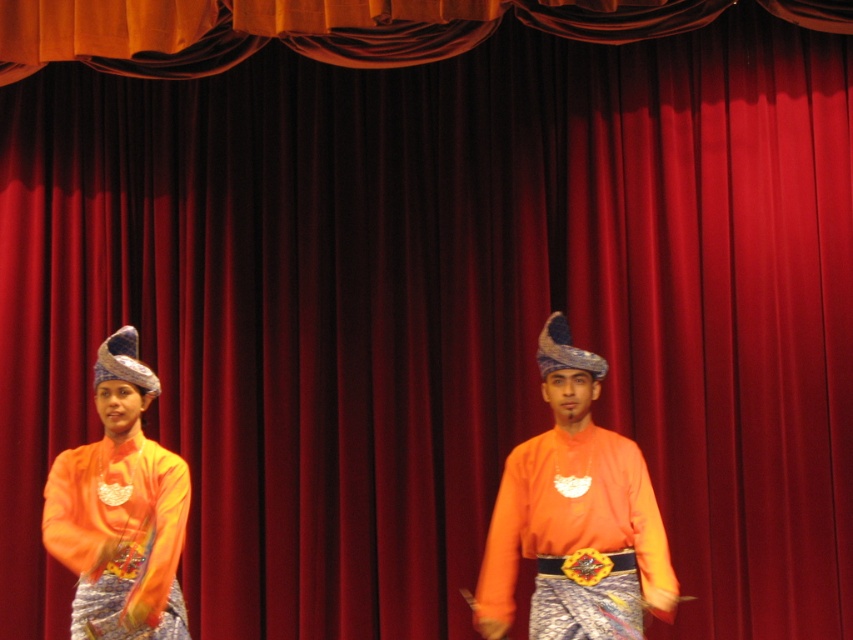
Question: Can you confirm if orange matte shirt at center is bigger than matte orange fabric at left?

Choices:
 (A) no
 (B) yes

Answer: (B)

Question: Does orange matte shirt at center appear on the right side of matte orange fabric at left?

Choices:
 (A) yes
 (B) no

Answer: (A)

Question: Which object appears farthest from the camera in this image?

Choices:
 (A) matte orange fabric at left
 (B) orange matte shirt at center

Answer: (B)

Question: Can you confirm if orange matte shirt at center is positioned above matte orange fabric at left?

Choices:
 (A) no
 (B) yes

Answer: (B)

Question: Which of the following is the closest to the observer?

Choices:
 (A) (155, 627)
 (B) (553, 433)

Answer: (A)